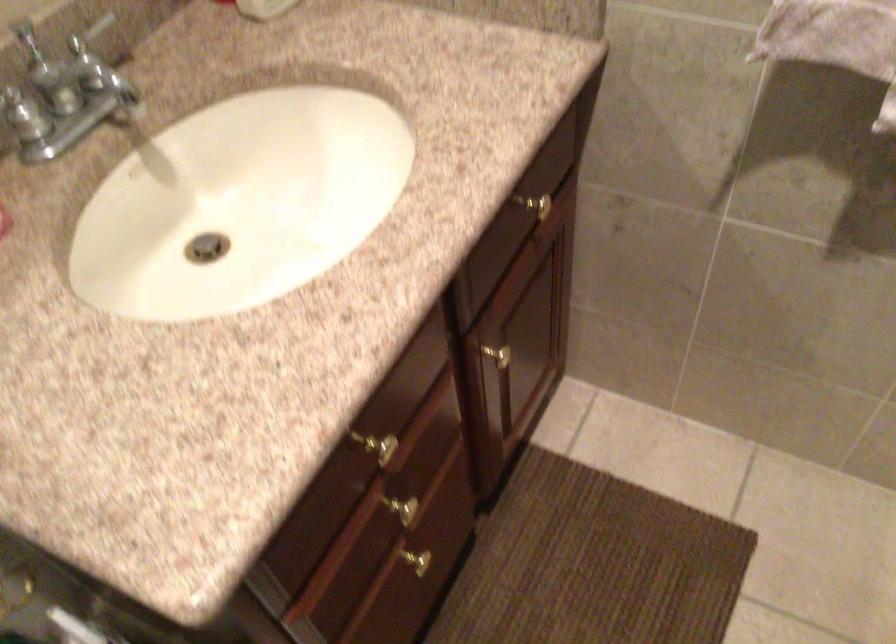
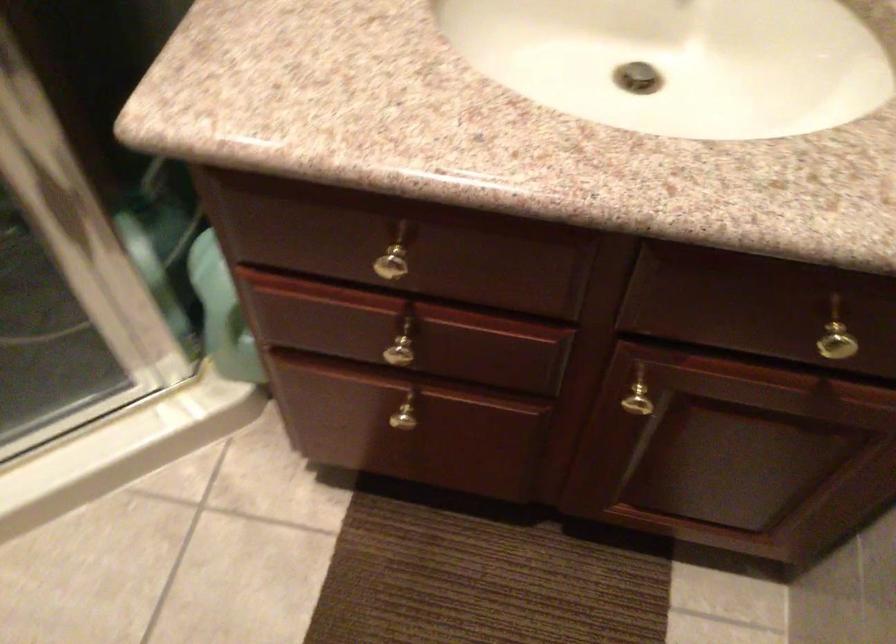
Where in the second image is the point corresponding to point 497,355 from the first image?

(640, 399)